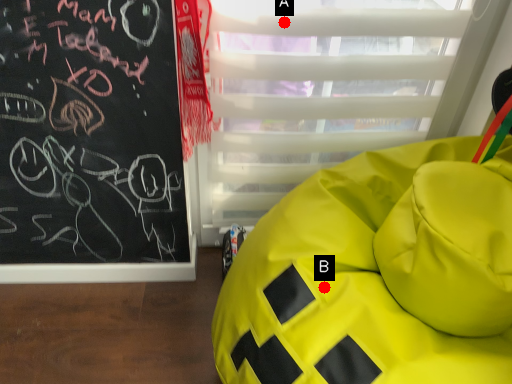
Question: Two points are circled on the image, labeled by A and B beside each circle. Among these points, which one is farthest from the camera?

Choices:
 (A) A is further
 (B) B is further

Answer: (A)